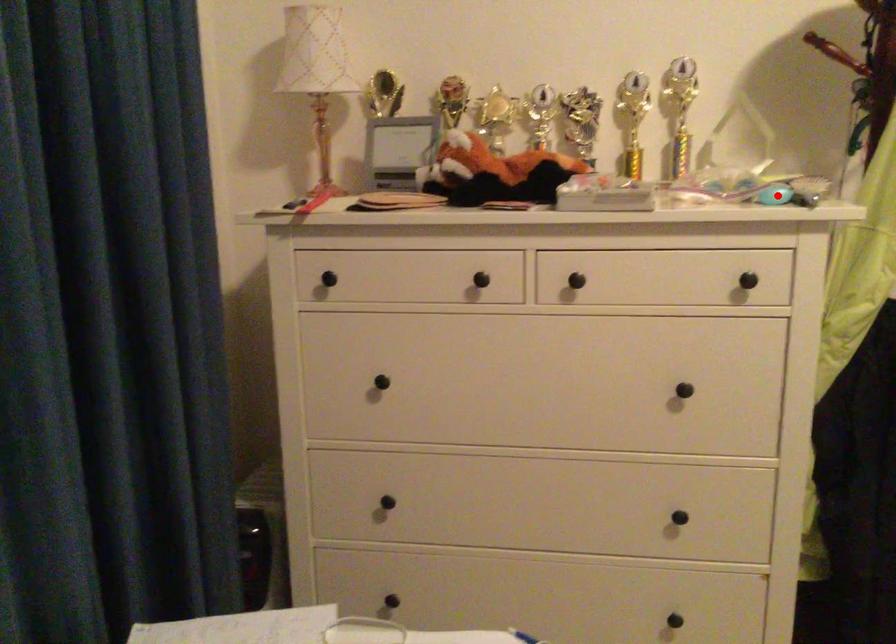
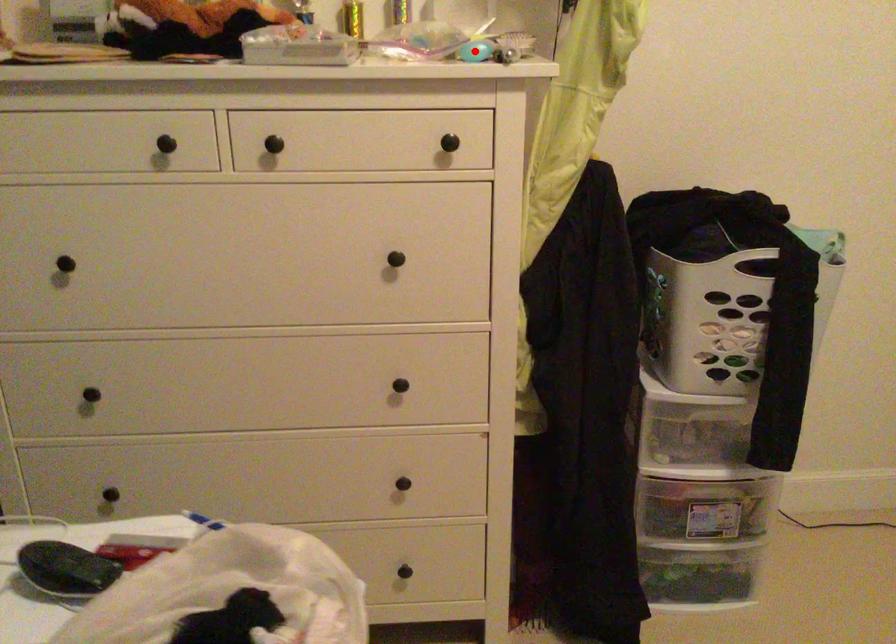
Consider the image. I am providing you with two images of the same scene from different viewpoints. A red point is marked on the first image and another point is marked on the second image. Are the points marked in image1 and image2 representing the same 3D position?

Yes